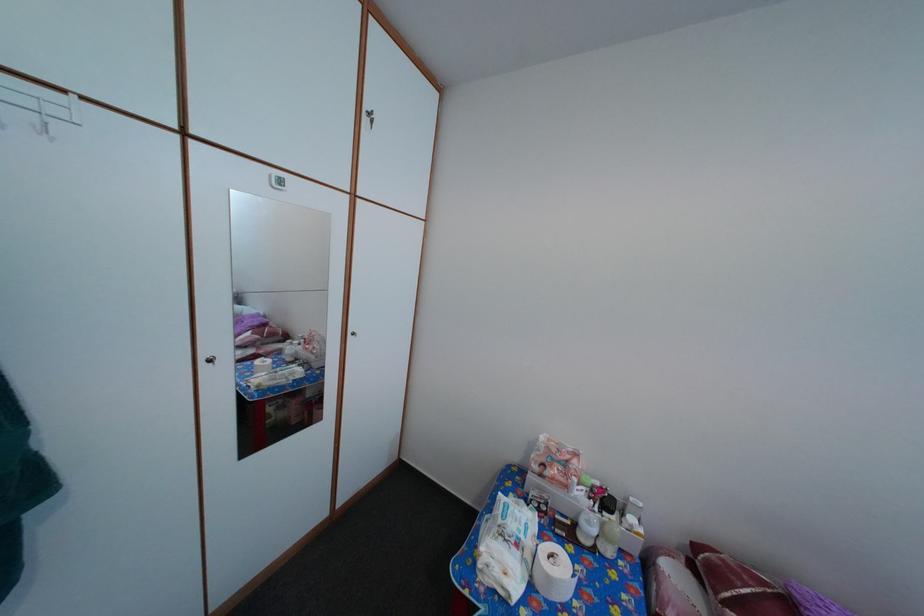
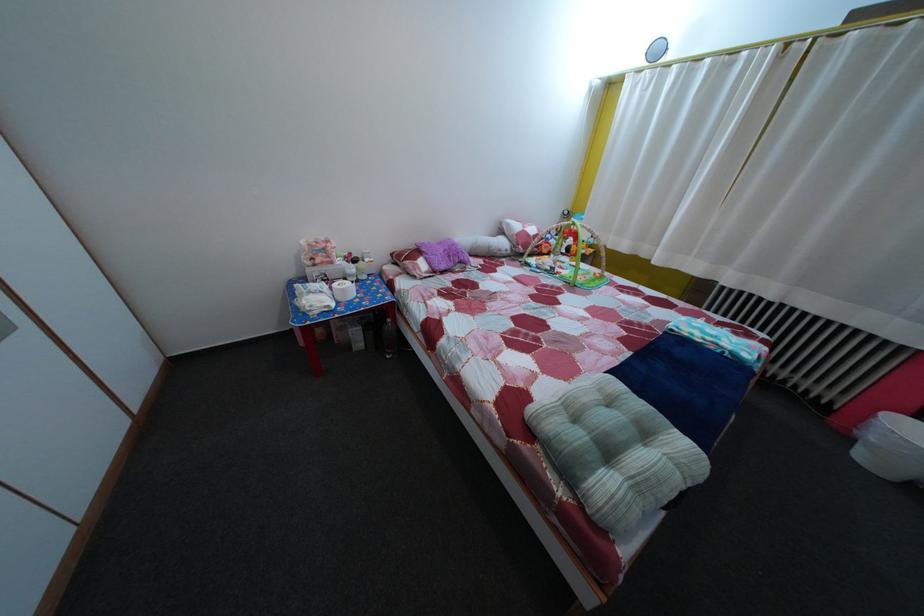
Based on the continuous images, in which direction is the camera rotating?

The rotation direction of the camera is right-down.